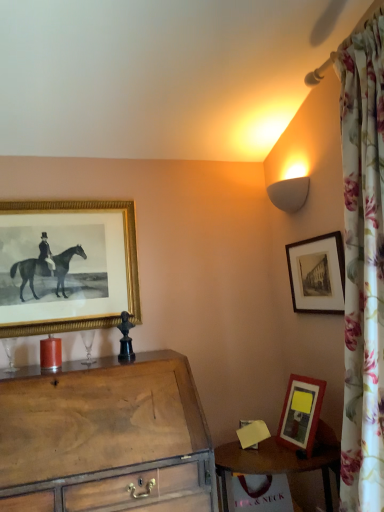
At what (x,y) coordinates should I click in order to perform the action: click on vacant area that is in front of matte glass candle at left. Please return your answer as a coordinate pair (x, y). The height and width of the screenshot is (512, 384). Looking at the image, I should click on (39, 381).